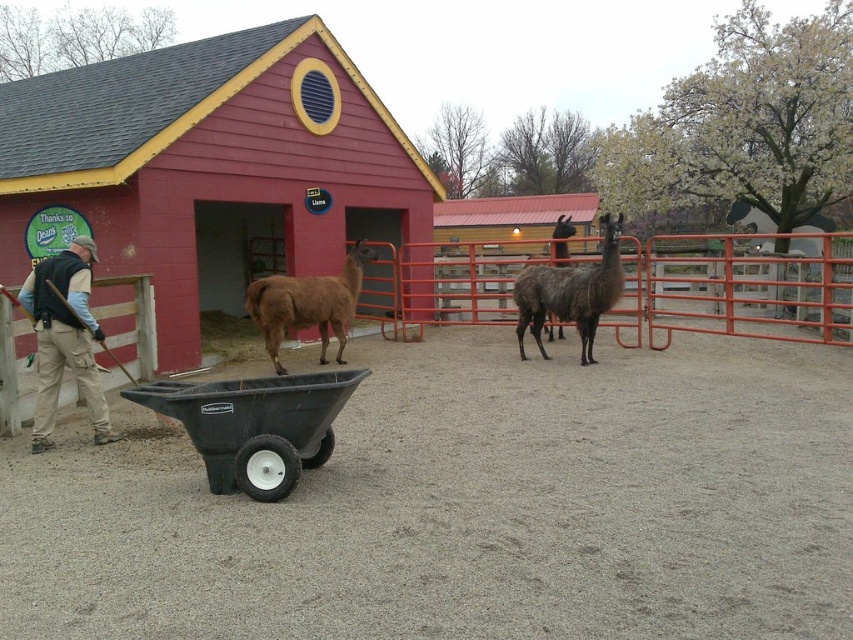
You are a photographer trying to capture a photo of the khaki pants at left and the brown woolly alpaca at center. Based on their heights, which one should you focus on first to ensure both are in frame without adjusting your camera angle?

The khaki pants at left is taller than the brown woolly alpaca at center, so you should focus on the khaki pants at left first to ensure both are in frame without adjusting your camera angle.

You are standing at the center of the image. There is a point marked at coordinates (64, 337). What object is located at that point?

The point at coordinates (64, 337) marks khaki pants at left.